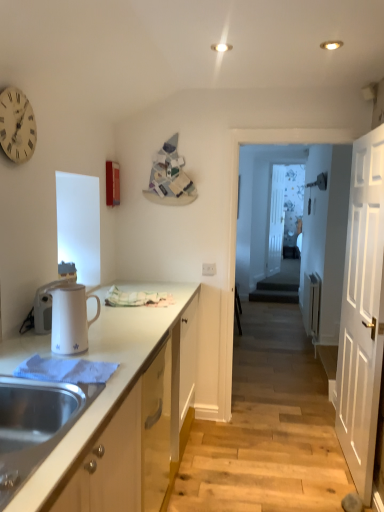
What do you see at coordinates (276, 219) in the screenshot? The width and height of the screenshot is (384, 512). I see `transparent glass door at center, the 2th glass door viewed from the front` at bounding box center [276, 219].

The image size is (384, 512). Describe the element at coordinates (70, 318) in the screenshot. I see `white glossy electric kettle at left, the second appliance positioned from the back` at that location.

Looking at this image, measure the distance between white glossy electric kettle at left, the second appliance in the front-to-back sequence, and camera.

The distance of white glossy electric kettle at left, the second appliance in the front-to-back sequence, from camera is 5.23 feet.

This screenshot has height=512, width=384. What do you see at coordinates (17, 125) in the screenshot?
I see `white wooden clock at upper left` at bounding box center [17, 125].

You are a GUI agent. You are given a task and a screenshot of the screen. Output one action in this format:
    pyautogui.click(x=<x>, y=<y>)
    Task: Click on the transparent glass door at center, the 2th glass door viewed from the front
    
    Given the screenshot: What is the action you would take?
    pyautogui.click(x=276, y=219)

Does white glossy electric kettle at left, which is the first appliance in front-to-back order, contain white wooden door at right?

No, white wooden door at right is not inside white glossy electric kettle at left, which is the first appliance in front-to-back order.

Which is behind, point (85, 335) or point (338, 433)?

Positioned behind is point (338, 433).

Which of these two, white glossy electric kettle at left, which ranks as the first appliance in right-to-left order, or white wooden door at right, is bigger?

Bigger between the two is white wooden door at right.

Is white glossy electric kettle at left, which ranks as the first appliance in right-to-left order, shorter than white wooden door at right?

Yes.

From the image's perspective, relative to white wooden clock at upper left, is white glossy electric kettle at left, which is the 2th appliance from left to right, above or below?

white glossy electric kettle at left, which is the 2th appliance from left to right, is below white wooden clock at upper left.

Which object is further away from the camera, white glossy electric kettle at left, the second appliance positioned from the back, or white wooden clock at upper left?

white wooden clock at upper left is behind.

Looking at this image, in terms of width, does white glossy electric kettle at left, the second appliance positioned from the back, look wider or thinner when compared to white wooden clock at upper left?

In the image, white glossy electric kettle at left, the second appliance positioned from the back, appears to be wider than white wooden clock at upper left.

Which point is more distant from viewer, (69, 325) or (35, 144)?

The point (35, 144) is more distant.

Does white glossy cabinet at lower left have a greater height compared to transparent glass door at center, the 1th glass door positioned from the back?

In fact, white glossy cabinet at lower left may be shorter than transparent glass door at center, the 1th glass door positioned from the back.

From the image's perspective, who appears lower, white glossy cabinet at lower left or transparent glass door at center, the 2th glass door viewed from the front?

white glossy cabinet at lower left, from the image's perspective.

Considering the relative positions of white glossy cabinet at lower left and transparent glass door at center, the 1th glass door positioned from the back, in the image provided, is white glossy cabinet at lower left in front of transparent glass door at center, the 1th glass door positioned from the back,?

Yes, the depth of white glossy cabinet at lower left is less than that of transparent glass door at center, the 1th glass door positioned from the back.

Is white glossy cabinet at lower left outside of transparent glass door at center, the 1th glass door positioned from the back?

white glossy cabinet at lower left is positioned outside transparent glass door at center, the 1th glass door positioned from the back.

Based on the photo, how many degrees apart are the facing directions of white plastic electric outlet at center and transparent glass door at center, which appears as the second glass door when viewed from the back?

22.5 degrees separate the facing orientations of white plastic electric outlet at center and transparent glass door at center, which appears as the second glass door when viewed from the back.

From a real-world perspective, is white plastic electric outlet at center above or below transparent glass door at center, arranged as the 1th glass door when viewed from the front?

Clearly, from a real-world perspective, white plastic electric outlet at center is below transparent glass door at center, arranged as the 1th glass door when viewed from the front.

From their relative heights in the image, would you say white plastic electric outlet at center is taller or shorter than transparent glass door at center, arranged as the 1th glass door when viewed from the front?

Clearly, white plastic electric outlet at center is shorter compared to transparent glass door at center, arranged as the 1th glass door when viewed from the front.

From a real-world perspective, is white plastic electric outlet at center above or below white glossy electric kettle at left, which is the first appliance in front-to-back order?

Clearly, from a real-world perspective, white plastic electric outlet at center is below white glossy electric kettle at left, which is the first appliance in front-to-back order.

Considering the relative sizes of white plastic electric outlet at center and white glossy electric kettle at left, the second appliance positioned from the back, in the image provided, is white plastic electric outlet at center taller than white glossy electric kettle at left, the second appliance positioned from the back,?

In fact, white plastic electric outlet at center may be shorter than white glossy electric kettle at left, the second appliance positioned from the back.

Is white plastic electric outlet at center positioned behind white glossy electric kettle at left, which is the 2th appliance from left to right?

Yes, white plastic electric outlet at center is further from the camera.

In the scene shown: Could you measure the distance between white plastic electric outlet at center and white glossy electric kettle at left, which ranks as the first appliance in right-to-left order?

4.83 feet.

Considering the relative sizes of transparent glass door at center, the 2th glass door viewed from the front, and transparent glass door at center, which appears as the second glass door when viewed from the back, in the image provided, is transparent glass door at center, the 2th glass door viewed from the front, thinner than transparent glass door at center, which appears as the second glass door when viewed from the back,?

Yes, transparent glass door at center, the 2th glass door viewed from the front, is thinner than transparent glass door at center, which appears as the second glass door when viewed from the back.

Is transparent glass door at center, the 1th glass door positioned from the back, in front of transparent glass door at center, which appears as the second glass door when viewed from the back?

No, transparent glass door at center, the 1th glass door positioned from the back, is behind transparent glass door at center, which appears as the second glass door when viewed from the back.

From a real-world perspective, which object rests below the other?

From a 3D spatial view, transparent glass door at center, arranged as the 1th glass door when viewed from the front, is below.

Consider the image. Which of these two, white wooden door at right or white plastic electric outlet at center, is thinner?

With smaller width is white plastic electric outlet at center.

Looking at this image, from the image's perspective, which one is positioned higher, white wooden door at right or white plastic electric outlet at center?

From the image's view, white plastic electric outlet at center is above.

Is white wooden door at right next to white plastic electric outlet at center?

No, white wooden door at right is not with white plastic electric outlet at center.

Looking at this image, how different are the orientations of white wooden door at right and white plastic electric outlet at center in degrees?

white wooden door at right and white plastic electric outlet at center are facing 89.6 degrees away from each other.

Find the location of a particular element. the 1st appliance counting from the left side of the white wooden door at right is located at coordinates (70, 318).

Find the location of a particular element. Image resolution: width=384 pixels, height=512 pixels. the 2nd appliance to the right of the white wooden clock at upper left, starting your count from the anchor is located at coordinates (70, 318).

Based on their spatial positions, is white wooden door at right or stainless steel sink at lower left closer to white glossy cabinet at lower left?

Based on the image, stainless steel sink at lower left appears to be nearer to white glossy cabinet at lower left.

From the image, which object appears to be farther from white glossy electric kettle at left, the second appliance in the front-to-back sequence, transparent glass door at center, which appears as the second glass door when viewed from the back, or white glossy electric kettle at left, which is the first appliance in front-to-back order?

transparent glass door at center, which appears as the second glass door when viewed from the back, is further to white glossy electric kettle at left, the second appliance in the front-to-back sequence.

Estimate the real-world distances between objects in this image. Which object is closer to transparent glass door at center, which appears as the second glass door when viewed from the back, transparent glass door at center, the 1th glass door positioned from the back, or white glossy electric kettle at left, which ranks as the first appliance in right-to-left order?

transparent glass door at center, the 1th glass door positioned from the back, is closer to transparent glass door at center, which appears as the second glass door when viewed from the back.

Which object lies further to the anchor point white plastic electric outlet at center, white glossy electric kettle at left, which ranks as the first appliance in right-to-left order, or white glossy electric kettle at left, acting as the 1th appliance starting from the left?

white glossy electric kettle at left, which ranks as the first appliance in right-to-left order, lies further to white plastic electric outlet at center than the other object.

From the image, which object appears to be farther from transparent glass door at center, the 1th glass door positioned from the back, white glossy electric kettle at left, which ranks as the first appliance in right-to-left order, or white wooden door at right?

white glossy electric kettle at left, which ranks as the first appliance in right-to-left order, lies further to transparent glass door at center, the 1th glass door positioned from the back, than the other object.

Based on their spatial positions, is transparent glass door at center, arranged as the 1th glass door when viewed from the front, or transparent glass door at center, the 1th glass door positioned from the back, closer to white wooden clock at upper left?

transparent glass door at center, the 1th glass door positioned from the back, is closer to white wooden clock at upper left.

Estimate the real-world distances between objects in this image. Which object is further from white glossy electric kettle at left, which is the 2th appliance from left to right, transparent glass door at center, which appears as the second glass door when viewed from the back, or white glossy cabinet at lower left?

transparent glass door at center, which appears as the second glass door when viewed from the back.

From the image, which object appears to be nearer to stainless steel sink at lower left, white plastic electric outlet at center or transparent glass door at center, the 2th glass door viewed from the front?

Among the two, white plastic electric outlet at center is located nearer to stainless steel sink at lower left.

Locate an element on the screen. This screenshot has height=512, width=384. door positioned between white wooden clock at upper left and transparent glass door at center, arranged as the 1th glass door when viewed from the front, from near to far is located at coordinates (362, 314).

Find the location of a particular element. appliance between stainless steel sink at lower left and white wooden door at right in the horizontal direction is located at coordinates (70, 318).

The height and width of the screenshot is (512, 384). Find the location of `clock between stainless steel sink at lower left and transparent glass door at center, which appears as the second glass door when viewed from the back, in the front-back direction`. clock between stainless steel sink at lower left and transparent glass door at center, which appears as the second glass door when viewed from the back, in the front-back direction is located at coordinates (17, 125).

At what (x,y) coordinates should I click in order to perform the action: click on cabinetry between white glossy electric kettle at left, which is the 2th appliance from left to right, and white plastic electric outlet at center, along the z-axis. Please return your answer as a coordinate pair (x, y). Looking at the image, I should click on (109, 380).